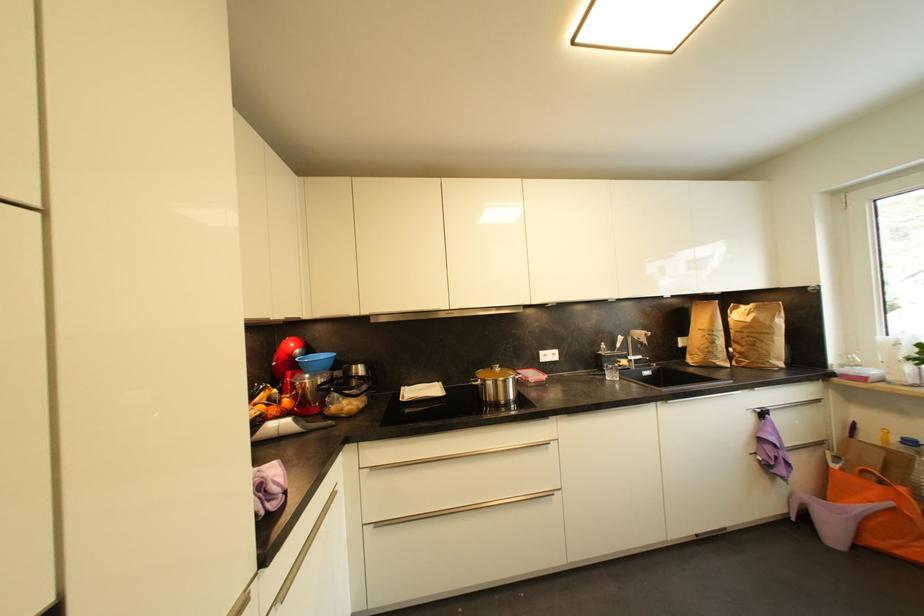
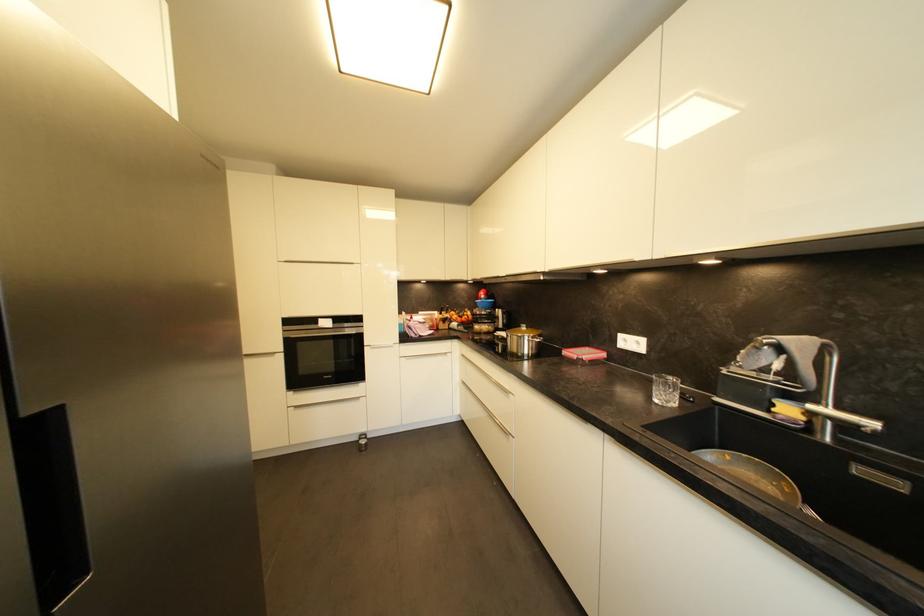
In the second image, find the point that corresponds to point (628, 363) in the first image.

(793, 411)